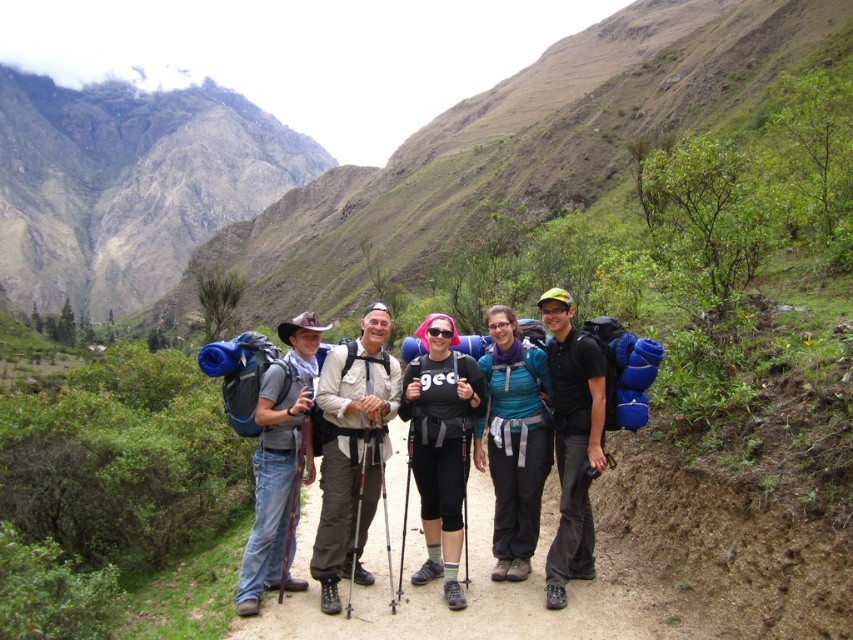
You are a hiker trying to find the correct path to continue your journey. You see a point marked at coordinates (444,600) in the image. Based on the scene description, where is this point located?

The point marked at coordinates (444,600) is located on the brown dirt path at center, which is the central area of the dirt path where the group of hikers is standing.

You are a hiker planning to walk along the brown dirt path at center while carrying the teal fabric backpack at center. Can you fit comfortably on the path without stepping off it?

The brown dirt path at center might be wider than the teal fabric backpack at center, so it is possible that you can fit comfortably on the path without stepping off it.

You are planning to hike along the dirt path and need to know if there is enough space for your group to walk side by side. Given the brown dirt path at center and the teal fabric backpack at center, can you determine if the path is wide enough?

The brown dirt path at center has a larger size compared to teal fabric backpack at center, so the path is wide enough for the group to walk side by side.